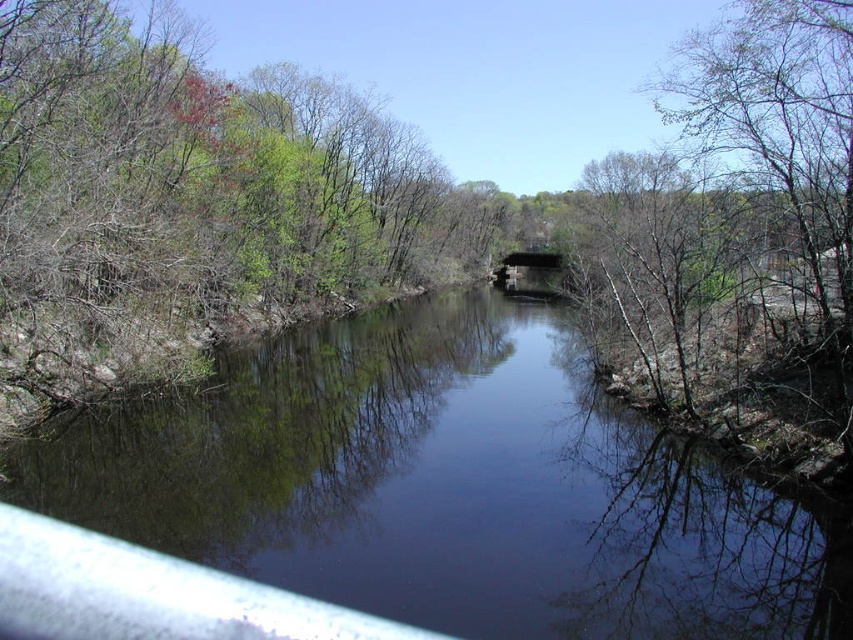
Question: Can you confirm if transparent water at center is positioned below concrete bridge at center?

Choices:
 (A) yes
 (B) no

Answer: (A)

Question: Where is transparent water at center located in relation to concrete bridge at center in the image?

Choices:
 (A) right
 (B) left

Answer: (B)

Question: Which of the following is the closest to the observer?

Choices:
 (A) transparent water at center
 (B) concrete bridge at center

Answer: (A)

Question: Can you confirm if transparent water at center is positioned to the left of concrete bridge at center?

Choices:
 (A) yes
 (B) no

Answer: (A)